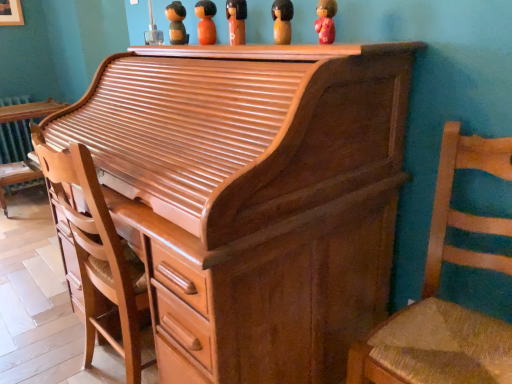
Question: Is wooden figurine at upper center, placed as the fifth toy when sorted from front to back, behind shiny brown wood desk at left?

Choices:
 (A) yes
 (B) no

Answer: (B)

Question: Is the position of wooden figurine at upper center, placed as the fifth toy when sorted from front to back, less distant than that of shiny brown wood desk at left?

Choices:
 (A) no
 (B) yes

Answer: (B)

Question: Does wooden figurine at upper center, placed as the fifth toy when sorted from front to back, have a lesser width compared to shiny brown wood desk at left?

Choices:
 (A) no
 (B) yes

Answer: (B)

Question: Is shiny brown wood desk at left a part of wooden figurine at upper center, acting as the first toy starting from the left?

Choices:
 (A) no
 (B) yes

Answer: (A)

Question: Is shiny brown wood desk at left at the back of wooden figurine at upper center, positioned as the fifth toy in right-to-left order?

Choices:
 (A) yes
 (B) no

Answer: (B)

Question: From the image's perspective, is wooden figurine at upper center, placed as the fifth toy when sorted from front to back, on top of shiny brown wood desk at left?

Choices:
 (A) no
 (B) yes

Answer: (B)

Question: From a real-world perspective, is matte pink figurine at upper center, the first toy viewed from the front, below shiny brown piano at center?

Choices:
 (A) no
 (B) yes

Answer: (A)

Question: Is shiny brown piano at center inside matte pink figurine at upper center, arranged as the first toy when viewed from the right?

Choices:
 (A) no
 (B) yes

Answer: (A)

Question: Does matte pink figurine at upper center, the fifth toy when ordered from left to right, lie in front of shiny brown piano at center?

Choices:
 (A) no
 (B) yes

Answer: (A)

Question: Is matte pink figurine at upper center, arranged as the first toy when viewed from the right, facing towards shiny brown piano at center?

Choices:
 (A) yes
 (B) no

Answer: (B)

Question: Considering the relative sizes of matte pink figurine at upper center, the 5th toy in the back-to-front sequence, and shiny brown piano at center in the image provided, is matte pink figurine at upper center, the 5th toy in the back-to-front sequence, bigger than shiny brown piano at center?

Choices:
 (A) yes
 (B) no

Answer: (B)

Question: Does matte pink figurine at upper center, arranged as the first toy when viewed from the right, touch shiny brown piano at center?

Choices:
 (A) no
 (B) yes

Answer: (A)

Question: Can you confirm if shiny brown wood desk at left is thinner than matte orange doll at upper center, the third toy positioned from the front?

Choices:
 (A) yes
 (B) no

Answer: (B)